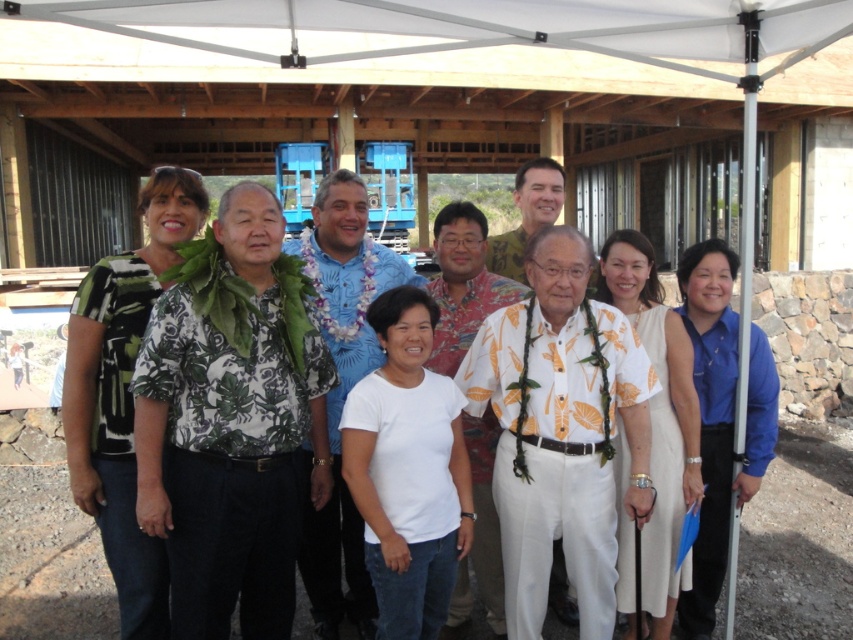
Can you confirm if white cotton shirt at center is positioned to the left of blue floral shirt at center?

Indeed, white cotton shirt at center is positioned on the left side of blue floral shirt at center.

Describe the element at coordinates (126, 392) in the screenshot. This screenshot has height=640, width=853. I see `white cotton shirt at center` at that location.

In order to click on white cotton shirt at center in this screenshot , I will do `click(126, 392)`.